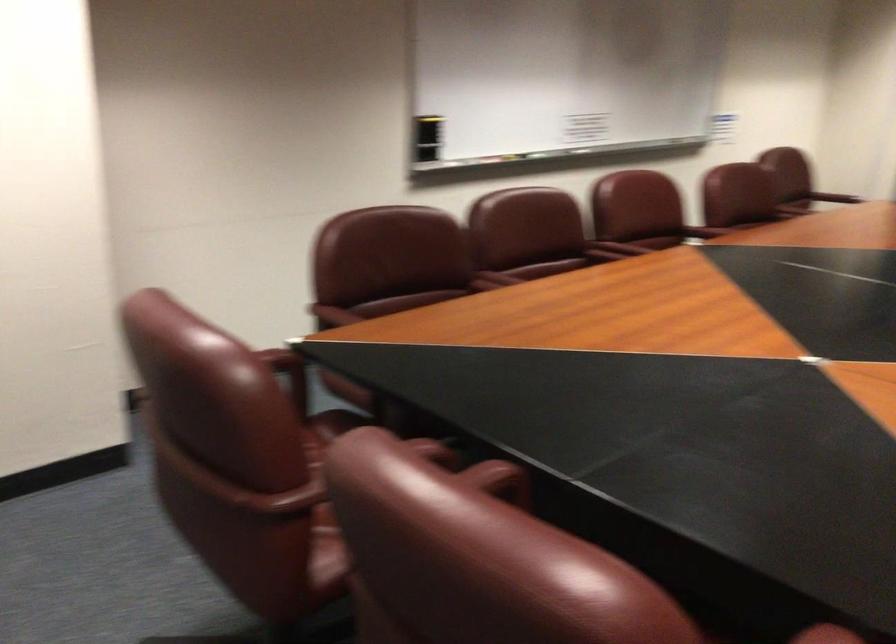
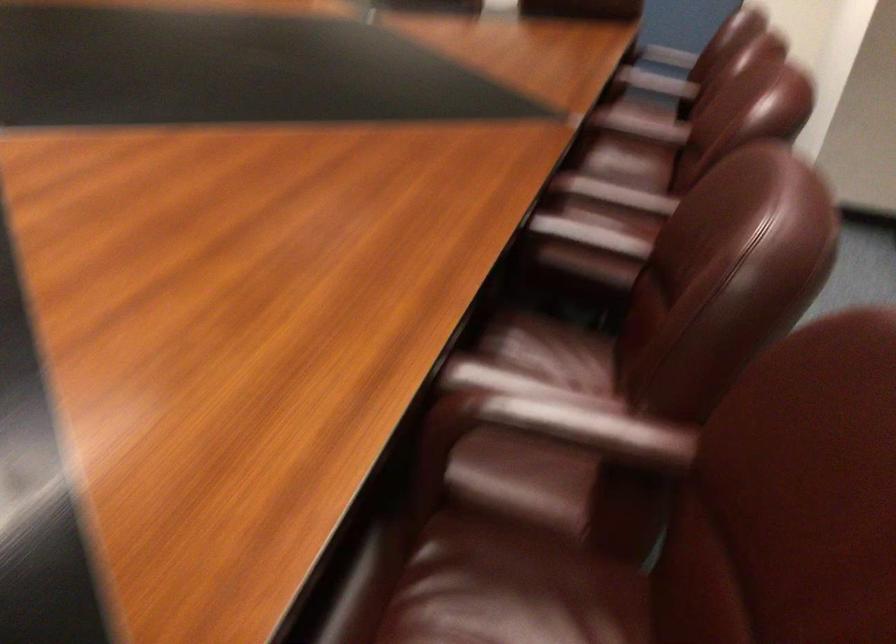
Where in the second image is the point corresponding to [642,242] from the first image?

(640, 126)